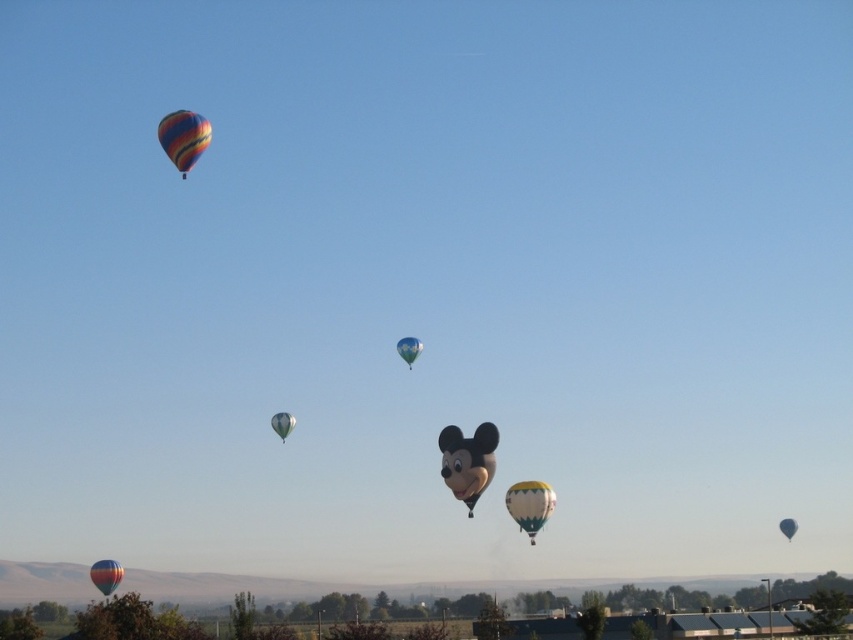
Where is `multicolored fabric hot air balloon at upper left`? multicolored fabric hot air balloon at upper left is located at coordinates (183, 138).

Does multicolored fabric hot air balloon at upper left lie in front of blue glossy balloon at upper center?

Yes, it is in front of blue glossy balloon at upper center.

The width and height of the screenshot is (853, 640). What are the coordinates of `multicolored fabric hot air balloon at upper left` in the screenshot? It's located at (183, 138).

Identify the location of multicolored fabric hot air balloon at upper left. The width and height of the screenshot is (853, 640). tap(183, 138).

Does yellow-green striped hot air balloon at center have a lesser width compared to blue glossy balloon at center?

No.

Can you confirm if yellow-green striped hot air balloon at center is shorter than blue glossy balloon at center?

Incorrect, yellow-green striped hot air balloon at center's height does not fall short of blue glossy balloon at center's.

Locate an element on the screen. The image size is (853, 640). yellow-green striped hot air balloon at center is located at coordinates (529, 506).

The height and width of the screenshot is (640, 853). Identify the location of yellow-green striped hot air balloon at center. pyautogui.click(x=529, y=506).

Does point (463, 492) come behind point (518, 486)?

Yes, point (463, 492) is farther from viewer.

Does matte black mickey mouse head at center lie in front of yellow-green striped hot air balloon at center?

Yes.

The image size is (853, 640). Describe the element at coordinates (467, 460) in the screenshot. I see `matte black mickey mouse head at center` at that location.

Locate an element on the screen. matte black mickey mouse head at center is located at coordinates (467, 460).